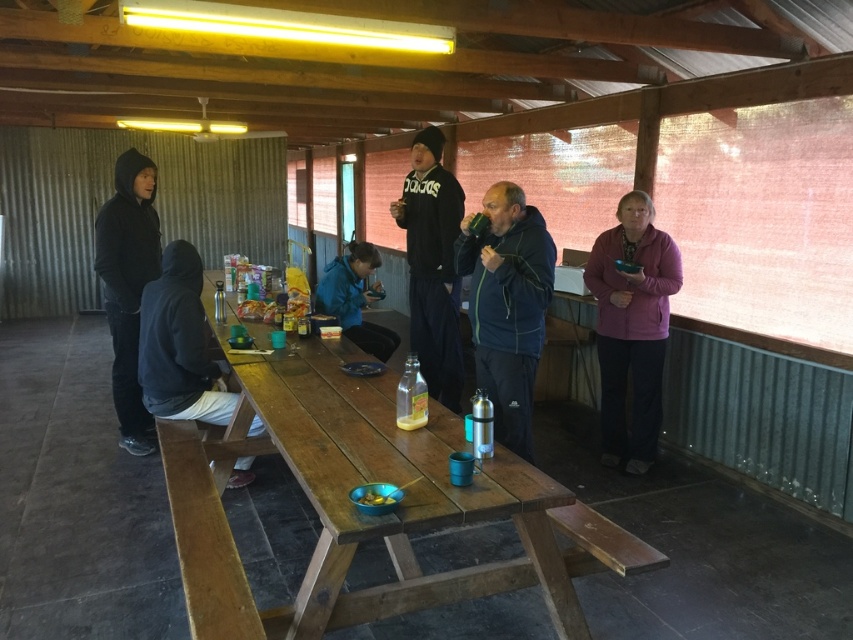
Does pink fleece jacket at right have a larger size compared to black hoodie at left?

Yes, pink fleece jacket at right is bigger than black hoodie at left.

Which is below, pink fleece jacket at right or black hoodie at left?

Positioned lower is pink fleece jacket at right.

Image resolution: width=853 pixels, height=640 pixels. What do you see at coordinates (631, 326) in the screenshot?
I see `pink fleece jacket at right` at bounding box center [631, 326].

Where is `pink fleece jacket at right`? pink fleece jacket at right is located at coordinates (631, 326).

Is point (131, 396) in front of point (355, 316)?

Yes, point (131, 396) is closer to viewer.

Can you confirm if black hoodie at left is shorter than blue fabric jacket at center?

Incorrect, black hoodie at left's height does not fall short of blue fabric jacket at center's.

This screenshot has width=853, height=640. What are the coordinates of `black hoodie at left` in the screenshot? It's located at (x=128, y=285).

Can you confirm if pink fleece jacket at right is positioned above black fabric jacket at left?

Indeed, pink fleece jacket at right is positioned over black fabric jacket at left.

Does point (618, 433) lie behind point (206, 349)?

Yes, point (618, 433) is farther from viewer.

Where is `pink fleece jacket at right`? This screenshot has height=640, width=853. pink fleece jacket at right is located at coordinates (631, 326).